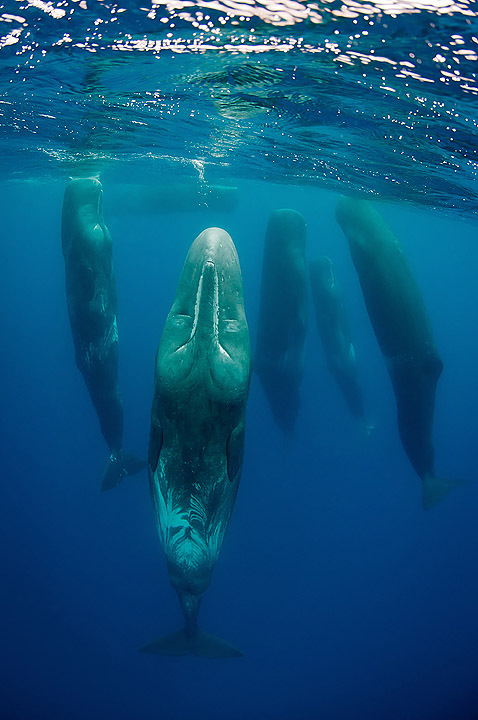
Locate an element on the screen. The width and height of the screenshot is (478, 720). light surface is located at coordinates (272, 12).